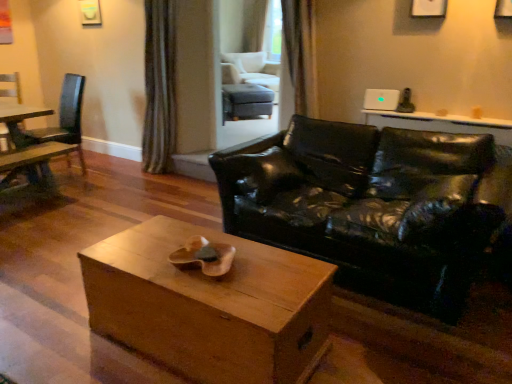
Question: Is point tap(48, 188) positioned closer to the camera than point tap(250, 87)?

Choices:
 (A) closer
 (B) farther

Answer: (A)

Question: Considering the positions of wooden bench at left and matte gray ottoman at center, the 3th chair from the left, in the image, is wooden bench at left wider or thinner than matte gray ottoman at center, the 3th chair from the left,?

Choices:
 (A) thin
 (B) wide

Answer: (A)

Question: Which object is positioned farthest from the wooden bench at left?

Choices:
 (A) satin curtain at upper center, which is the second curtain in back-to-front order
 (B) green textured curtain at upper center, the 2th curtain in the front-to-back sequence
 (C) wooden box at center
 (D) wooden chair at left, acting as the third chair starting from the back
 (E) wooden chair at left, the 3th chair in the right-to-left sequence

Answer: (C)

Question: Estimate the real-world distances between objects in this image. Which object is farther from the wooden chair at left, which is the second chair in right-to-left order?

Choices:
 (A) wooden chair at left, the 3th chair in the right-to-left sequence
 (B) wooden bench at left
 (C) satin curtain at upper center, which is the second curtain in back-to-front order
 (D) green textured curtain at upper center, positioned as the 2th curtain in right-to-left order
 (E) wooden box at center

Answer: (E)